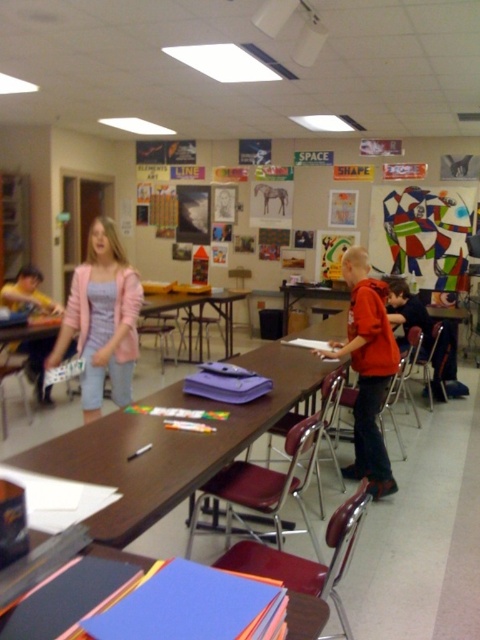
Who is positioned more to the right, pink fabric jacket at center or smooth blue paper at center?

Positioned to the right is smooth blue paper at center.

Is pink fabric jacket at center bigger than smooth blue paper at center?

Yes.

Find the location of a particular element. The image size is (480, 640). pink fabric jacket at center is located at coordinates (101, 320).

Image resolution: width=480 pixels, height=640 pixels. Identify the location of pink fabric jacket at center. (101, 320).

Where is `brown wooden table at center`? The width and height of the screenshot is (480, 640). brown wooden table at center is located at coordinates (169, 444).

Who is more forward, (363, 358) or (317, 604)?

Point (317, 604) is more forward.

Describe the element at coordinates (368, 371) in the screenshot. I see `orange matte shirt at center` at that location.

This screenshot has width=480, height=640. Identify the location of orange matte shirt at center. (368, 371).